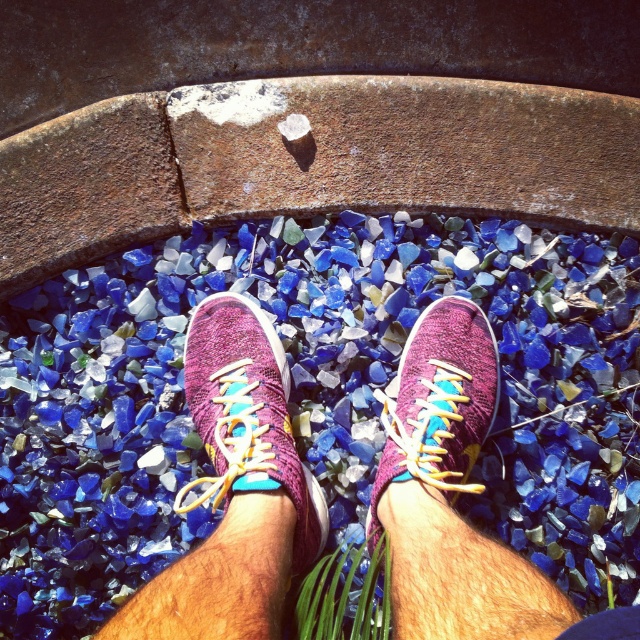
Question: Which object appears closest to the camera in this image?

Choices:
 (A) knit fabric sneaker at center
 (B) pink knitted sneakers at center

Answer: (B)

Question: Is pink knitted sneakers at center above knit fabric sneaker at center?

Choices:
 (A) yes
 (B) no

Answer: (B)

Question: Among these objects, which one is farthest from the camera?

Choices:
 (A) pink knitted sneakers at center
 (B) knit fabric sneaker at center

Answer: (B)

Question: Can you confirm if pink knitted sneakers at center is positioned above knit fabric sneaker at center?

Choices:
 (A) no
 (B) yes

Answer: (A)

Question: Which of the following is the closest to the observer?

Choices:
 (A) pink knitted sneakers at center
 (B) knit fabric sneaker at center
 (C) knitted purple shoe at center

Answer: (A)

Question: Does pink knitted sneakers at center appear under knit fabric sneaker at center?

Choices:
 (A) yes
 (B) no

Answer: (A)